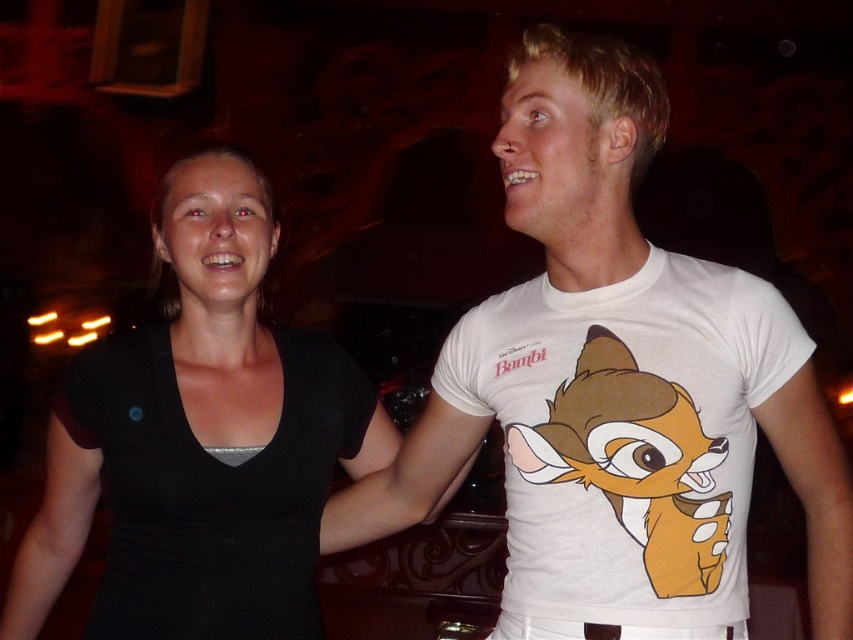
Is white cotton t-shirt at upper right positioned in front of black matte dress at left?

Yes, white cotton t-shirt at upper right is in front of black matte dress at left.

Which is behind, point (621, 531) or point (192, 328)?

The point (192, 328) is more distant.

Who is more distant from viewer, (544, 65) or (207, 433)?

Point (207, 433)

Locate an element on the screen. white cotton t-shirt at upper right is located at coordinates 614,388.

Where is `white cotton t-shirt at upper right`? This screenshot has height=640, width=853. white cotton t-shirt at upper right is located at coordinates (614, 388).

Which is more to the left, white cotton t-shirt at upper right or white cotton t-shirt at right?

white cotton t-shirt at upper right

Which is in front, point (566, 604) or point (767, 364)?

Positioned in front is point (767, 364).

The image size is (853, 640). What are the coordinates of `white cotton t-shirt at upper right` in the screenshot? It's located at (614, 388).

Between point (514, 465) and point (4, 611), which one is positioned behind?

Positioned behind is point (4, 611).

Is white cotton t-shirt at right shorter than black matte dress at left?

Correct, white cotton t-shirt at right is not as tall as black matte dress at left.

Identify the location of white cotton t-shirt at right. The width and height of the screenshot is (853, 640). (625, 436).